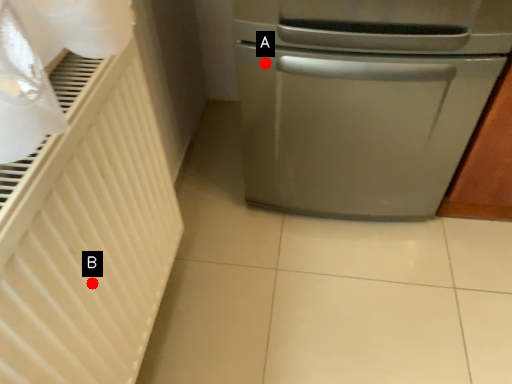
Question: Two points are circled on the image, labeled by A and B beside each circle. Which of the following is the closest to the observer?

Choices:
 (A) A is closer
 (B) B is closer

Answer: (B)